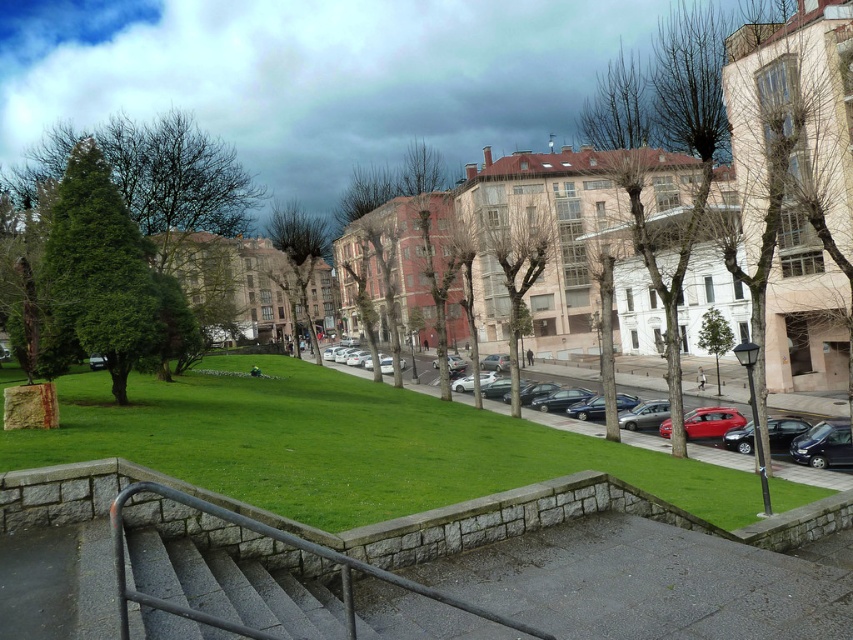
Is point (126, 120) positioned before point (422, 589)?

No, (126, 120) is behind (422, 589).

Between point (132, 134) and point (341, 561), which one is positioned behind?

Point (132, 134)

The height and width of the screenshot is (640, 853). In order to click on green textured tree at left in this screenshot , I will do `click(155, 173)`.

Does green leafy tree at center have a lesser height compared to metallic gray car at lower right?

No.

In the scene shown: Does green leafy tree at center come behind metallic gray car at lower right?

That is True.

Find the location of a particular element. green leafy tree at center is located at coordinates (299, 250).

Locate an element on the screen. The width and height of the screenshot is (853, 640). green leafy tree at center is located at coordinates (299, 250).

Does point (158, 212) lie in front of point (589, 403)?

No.

Is green textured tree at left wider than metallic silver car at lower center?

Yes, green textured tree at left is wider than metallic silver car at lower center.

Does point (39, 148) come closer to viewer compared to point (619, 410)?

No, (39, 148) is behind (619, 410).

Locate an element on the screen. green textured tree at left is located at coordinates (155, 173).